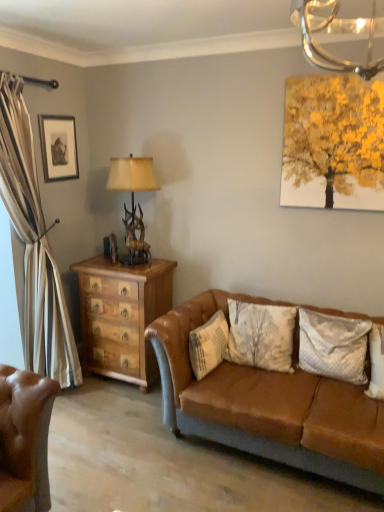
Question: Is velvety white pillow at center right, the 2th pillow when ordered from left to right, at the back of white textured pillow at center, which is the second pillow in right-to-left order?

Choices:
 (A) yes
 (B) no

Answer: (B)

Question: From a real-world perspective, does white textured pillow at center, which is the second pillow in right-to-left order, sit lower than velvety white pillow at center right, the 2th pillow when ordered from left to right?

Choices:
 (A) yes
 (B) no

Answer: (A)

Question: Is white textured pillow at center, which appears as the 1th pillow when viewed from the left, oriented towards velvety white pillow at center right, the 1th pillow viewed from the right?

Choices:
 (A) no
 (B) yes

Answer: (B)

Question: From the image's perspective, is white textured pillow at center, which is the second pillow in right-to-left order, under velvety white pillow at center right, the 1th pillow viewed from the right?

Choices:
 (A) no
 (B) yes

Answer: (B)

Question: Can you confirm if white textured pillow at center, which appears as the 1th pillow when viewed from the left, is bigger than velvety white pillow at center right, the 1th pillow viewed from the right?

Choices:
 (A) no
 (B) yes

Answer: (B)

Question: Is white textured pillow at center, which appears as the 1th pillow when viewed from the left, wider than velvety white pillow at center right, the 1th pillow viewed from the right?

Choices:
 (A) no
 (B) yes

Answer: (A)

Question: Does antler-patterned wood table lamp at left have a lesser width compared to matte black frame at upper left?

Choices:
 (A) no
 (B) yes

Answer: (A)

Question: Is antler-patterned wood table lamp at left taller than matte black frame at upper left?

Choices:
 (A) no
 (B) yes

Answer: (B)

Question: Considering the relative positions of antler-patterned wood table lamp at left and matte black frame at upper left in the image provided, is antler-patterned wood table lamp at left to the right of matte black frame at upper left from the viewer's perspective?

Choices:
 (A) no
 (B) yes

Answer: (B)

Question: Is antler-patterned wood table lamp at left further to camera compared to matte black frame at upper left?

Choices:
 (A) no
 (B) yes

Answer: (A)

Question: Is matte black frame at upper left inside antler-patterned wood table lamp at left?

Choices:
 (A) no
 (B) yes

Answer: (A)

Question: Is antler-patterned wood table lamp at left turned away from matte black frame at upper left?

Choices:
 (A) yes
 (B) no

Answer: (B)

Question: Considering the relative sizes of velvety white pillow at center right, the 2th pillow when ordered from left to right, and brown leather couch at center in the image provided, is velvety white pillow at center right, the 2th pillow when ordered from left to right, taller than brown leather couch at center?

Choices:
 (A) no
 (B) yes

Answer: (A)